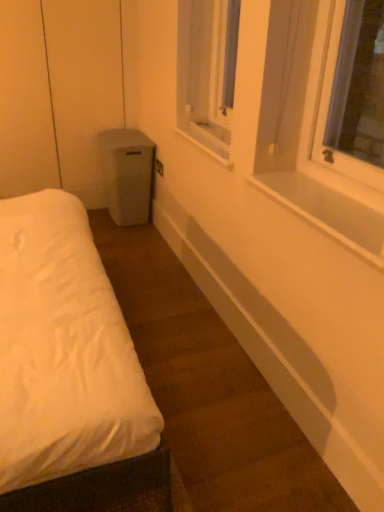
I want to click on free location above white smooth window sill at upper right, which is the second window sill from top to bottom (from a real-world perspective), so click(x=344, y=204).